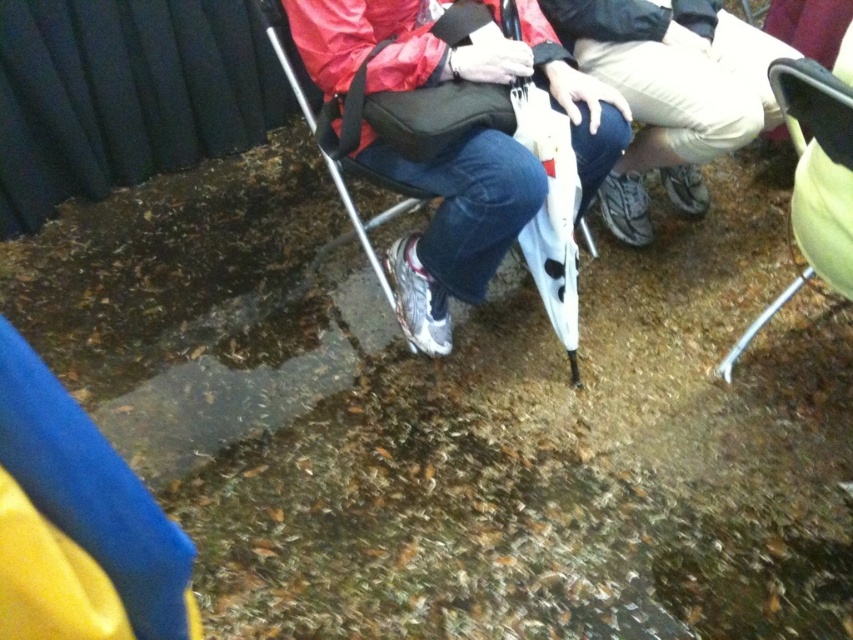
You are a delivery person who needs to place a small package between the khaki cotton pants at center and the green fabric folding chair at right. The package is 40 centimeters long. Will it fit in the space between them?

The khaki cotton pants at center and green fabric folding chair at right are 39.41 centimeters apart from each other. The package is 40 centimeters long, so it will not fit in the space between them.

You are a photographer trying to capture a clear shot of the khaki cotton pants at center and the metallic silver chair at center. Which object should you focus on first to ensure it appears sharp in the photo?

You should focus on the khaki cotton pants at center first because it is closer to the viewer than the metallic silver chair at center, ensuring it will be in focus before adjusting for the chair.

From the picture: You are planning to place a small potted plant between the metallic silver chair at center and the green fabric folding chair at right. Based on their positions, which chair should the plant be closer to?

The metallic silver chair at center is positioned over the green fabric folding chair at right, so the plant should be placed closer to the metallic silver chair at center to ensure it is visible and accessible.